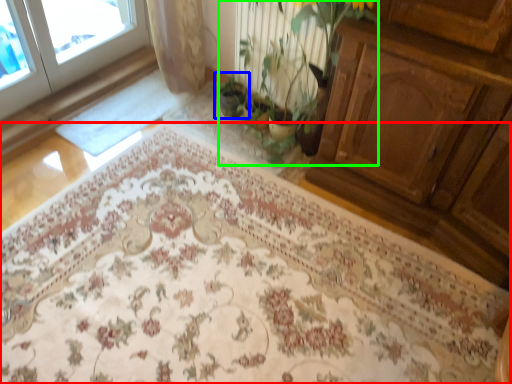
Question: Which object is positioned farthest from mat (highlighted by a red box)? Select from houseplant (highlighted by a blue box) and floral arrangement (highlighted by a green box).

Choices:
 (A) houseplant
 (B) floral arrangement

Answer: (A)